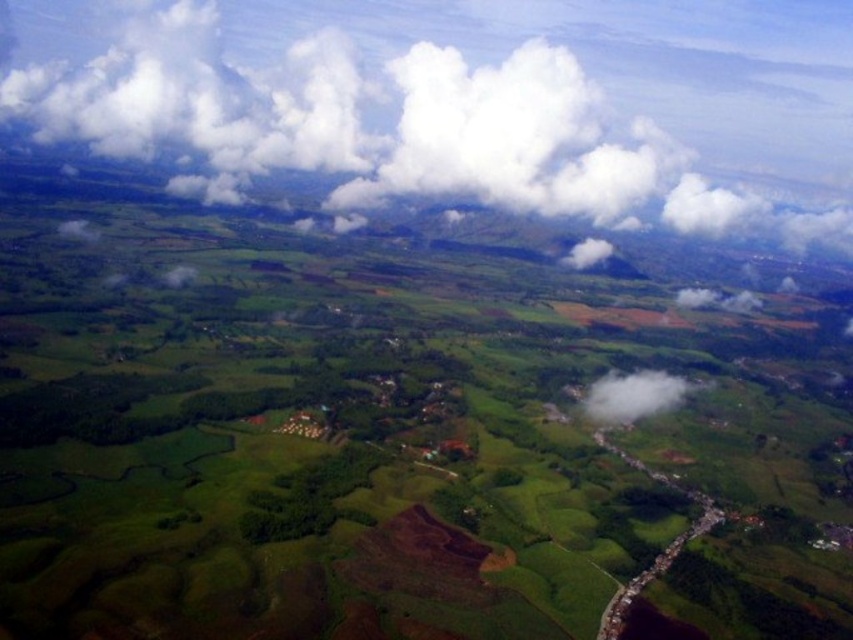
You are a pilot flying over the landscape and need to determine which object below you is bigger. You see the green grassy field at center and the white fluffy cloud at center. Which one has a larger area?

The green grassy field at center is larger in size than the white fluffy cloud at center, so the green grassy field at center has a larger area.

You are a pilot flying over the landscape and need to identify landmarks. Which object, the green grassy field at center or the white fluffy cloud at upper center, would be larger in size when viewed from your airplane window?

The green grassy field at center is bigger than the white fluffy cloud at upper center, so the green grassy field at center would appear larger when viewed from the airplane window.

You are a pilot flying at a high altitude and notice the green grassy field at center and the white fluffy cloud at upper center. Which object is closer to your aircraft?

The green grassy field at center is closer to the viewer than the white fluffy cloud at upper center, so the green grassy field at center is closer to the aircraft.